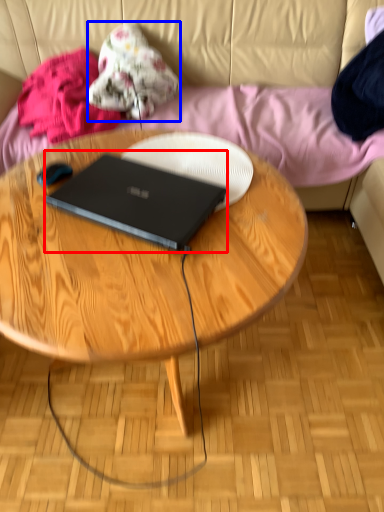
Question: Which point is further to the camera, laptop (highlighted by a red box) or clothing (highlighted by a blue box)?

Choices:
 (A) laptop
 (B) clothing

Answer: (B)